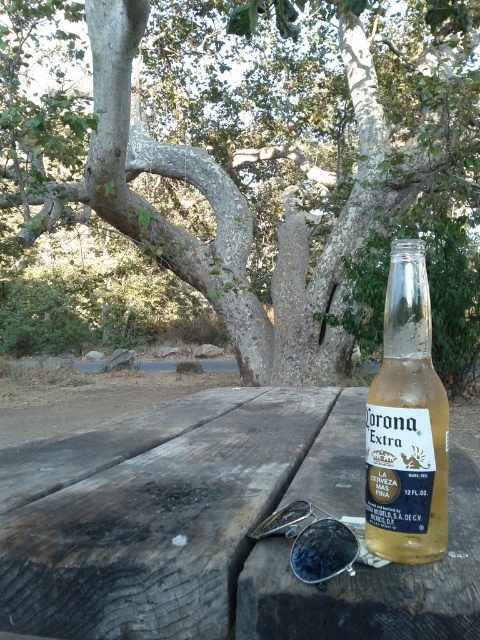
I want to click on smooth gray bark tree at center, so click(x=238, y=186).

Is point (252, 26) positioned in front of point (375, 410)?

No, it is not.

Based on the photo, measure the distance between point (95, 17) and camera.

Point (95, 17) is 4.36 meters from camera.

The image size is (480, 640). Find the location of `smooth gray bark tree at center`. smooth gray bark tree at center is located at coordinates (238, 186).

Locate an element on the screen. Image resolution: width=480 pixels, height=640 pixels. wooden at center is located at coordinates (216, 528).

Where is `wooden at center`? Image resolution: width=480 pixels, height=640 pixels. wooden at center is located at coordinates (216, 528).

Is wooden at center smaller than translucent glass bottle at center?

Incorrect, wooden at center is not smaller in size than translucent glass bottle at center.

In the scene shown: Can you confirm if wooden at center is wider than translucent glass bottle at center?

Yes.

Between point (232, 390) and point (407, 419), which one is positioned in front?

Point (407, 419) is more forward.

The image size is (480, 640). I want to click on wooden at center, so click(216, 528).